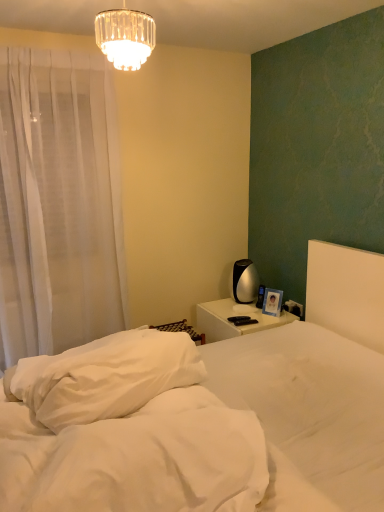
Question: Is matte blue photo frame at right facing towards white soft mattress at lower center?

Choices:
 (A) yes
 (B) no

Answer: (A)

Question: From a real-world perspective, is matte blue photo frame at right positioned under white soft mattress at lower center based on gravity?

Choices:
 (A) no
 (B) yes

Answer: (B)

Question: Does matte blue photo frame at right have a greater width compared to white soft mattress at lower center?

Choices:
 (A) yes
 (B) no

Answer: (B)

Question: From the image's perspective, is matte blue photo frame at right on white soft mattress at lower center?

Choices:
 (A) no
 (B) yes

Answer: (B)

Question: Is matte blue photo frame at right to the left of white soft mattress at lower center from the viewer's perspective?

Choices:
 (A) no
 (B) yes

Answer: (A)

Question: From a real-world perspective, is matte blue photo frame at right on white soft mattress at lower center?

Choices:
 (A) yes
 (B) no

Answer: (B)

Question: Is crystal glass chandelier at upper center far away from white glossy nightstand at center?

Choices:
 (A) yes
 (B) no

Answer: (A)

Question: From a real-world perspective, does crystal glass chandelier at upper center sit lower than white glossy nightstand at center?

Choices:
 (A) yes
 (B) no

Answer: (B)

Question: Does crystal glass chandelier at upper center touch white glossy nightstand at center?

Choices:
 (A) yes
 (B) no

Answer: (B)

Question: From a real-world perspective, does crystal glass chandelier at upper center stand above white glossy nightstand at center?

Choices:
 (A) no
 (B) yes

Answer: (B)

Question: Does crystal glass chandelier at upper center have a larger size compared to white glossy nightstand at center?

Choices:
 (A) yes
 (B) no

Answer: (B)

Question: Does crystal glass chandelier at upper center appear on the right side of white glossy nightstand at center?

Choices:
 (A) no
 (B) yes

Answer: (A)

Question: From the image's perspective, would you say crystal glass chandelier at upper center is positioned over white soft bed at center?

Choices:
 (A) yes
 (B) no

Answer: (A)